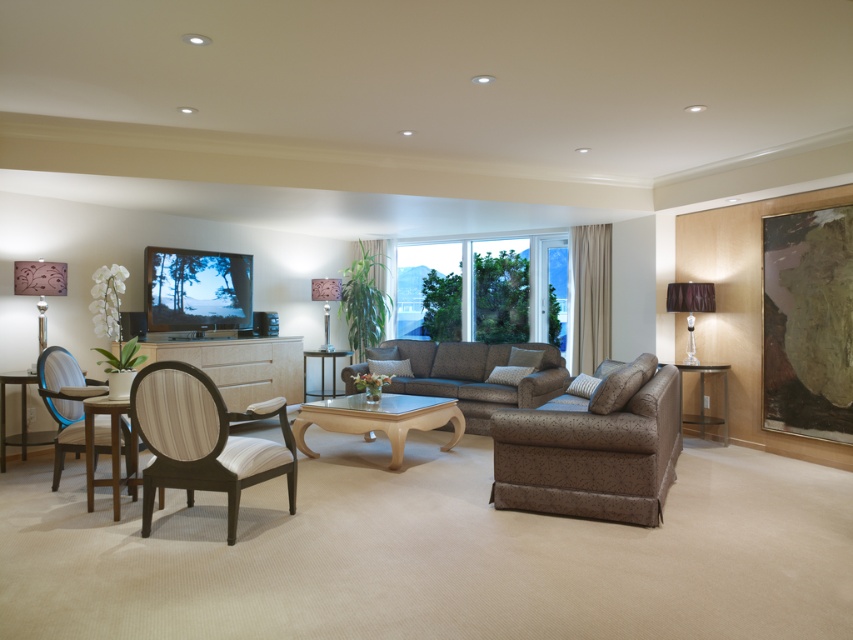
Question: Does translucent blue armchair at left have a greater width compared to clear glass side table at right?

Choices:
 (A) no
 (B) yes

Answer: (B)

Question: Which point is farther to the camera?

Choices:
 (A) wooden armchair with white cushioning at lower left
 (B) translucent blue armchair at left
 (C) metallic glass table at center

Answer: (C)

Question: Estimate the real-world distances between objects in this image. Which object is closer to the dark gray fabric couch at center?

Choices:
 (A) wooden table at lower left
 (B) wooden table at left

Answer: (A)

Question: Does translucent blue armchair at left appear on the left side of metallic silver lampshade at left?

Choices:
 (A) no
 (B) yes

Answer: (A)

Question: Which object is positioned farthest from the translucent blue armchair at left?

Choices:
 (A) wooden table at lower left
 (B) metallic silver lampshade at left

Answer: (B)

Question: Can you confirm if wooden armchair with white cushioning at lower left is positioned below wooden table at left?

Choices:
 (A) yes
 (B) no

Answer: (A)